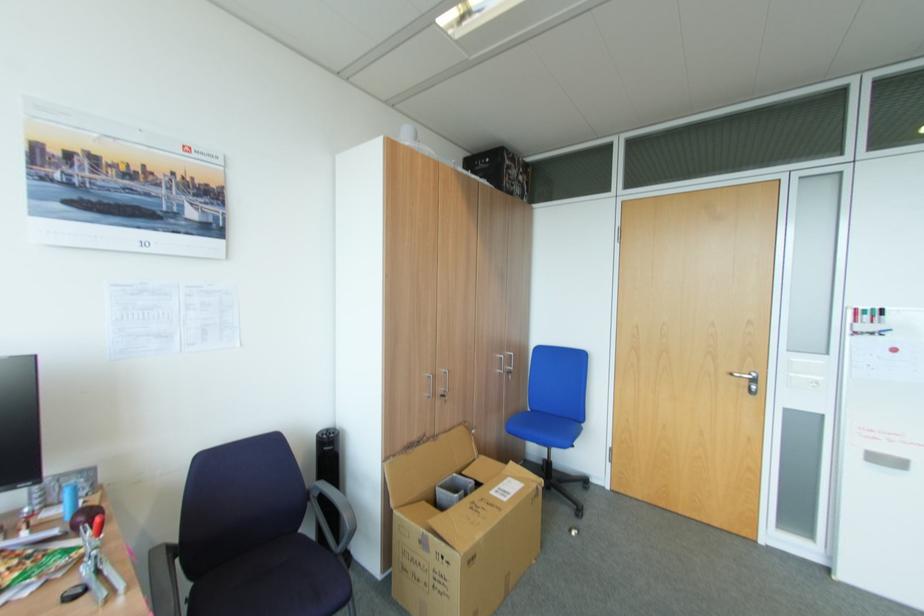
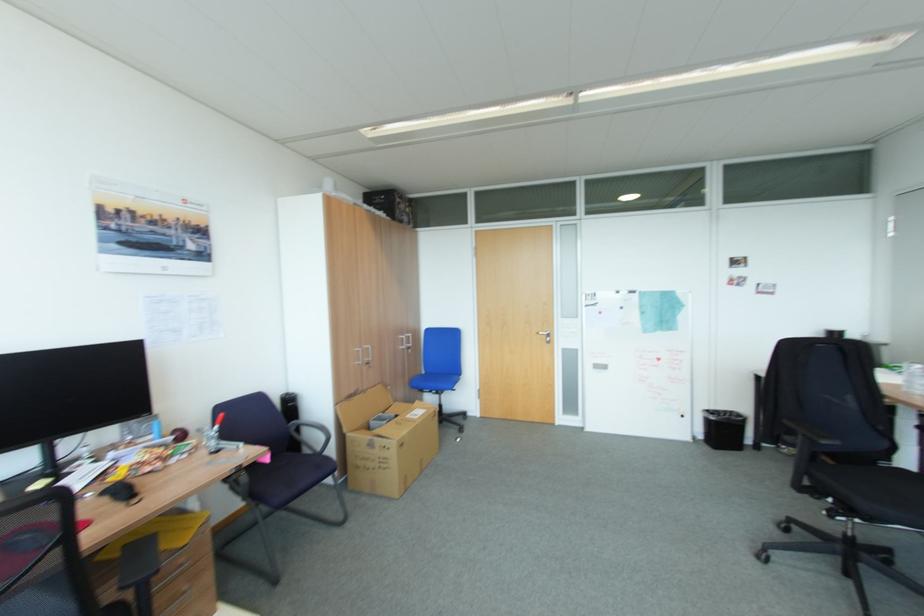
In the second image, find the point that corresponds to point (751, 381) in the first image.

(551, 336)